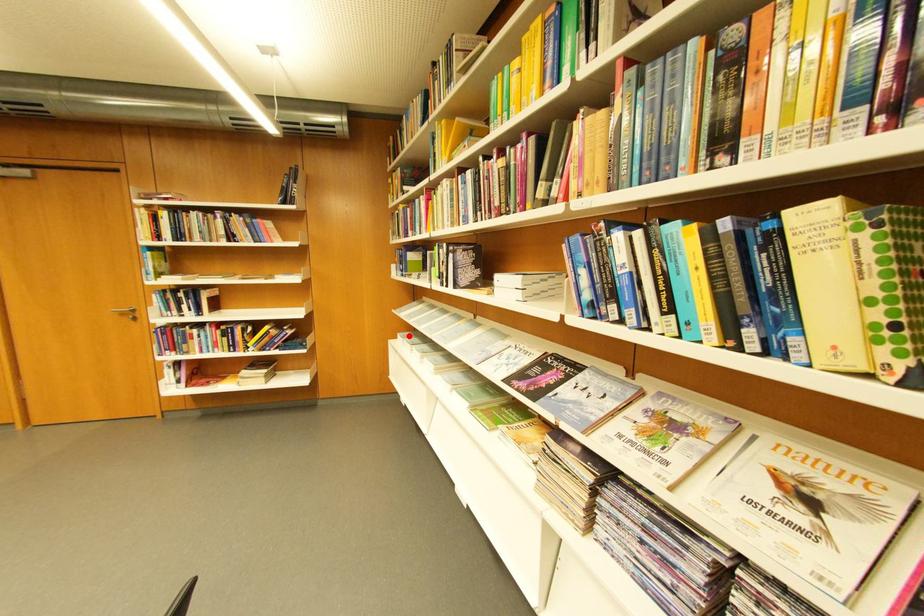
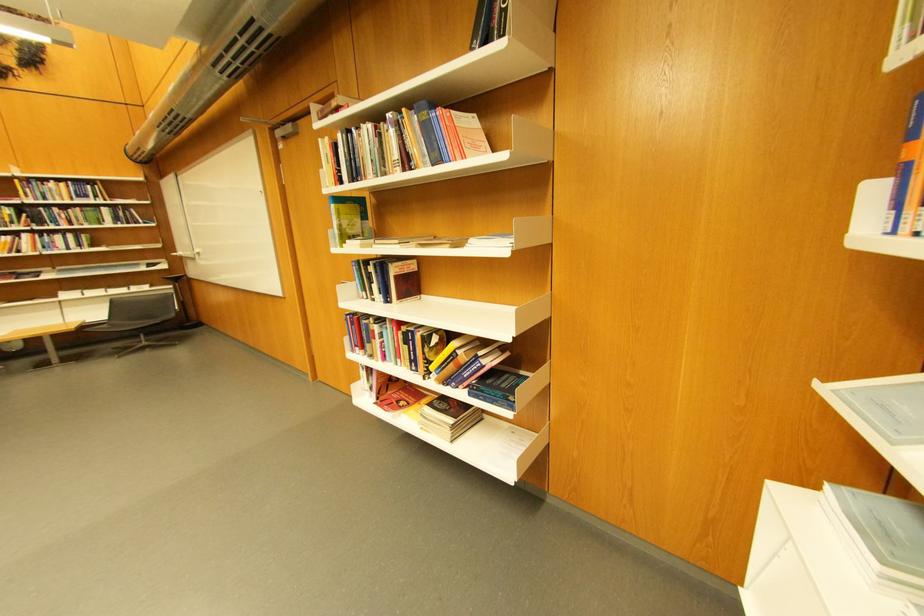
Find the pixel in the second image that matches the highlighted location in the first image.

(837, 485)